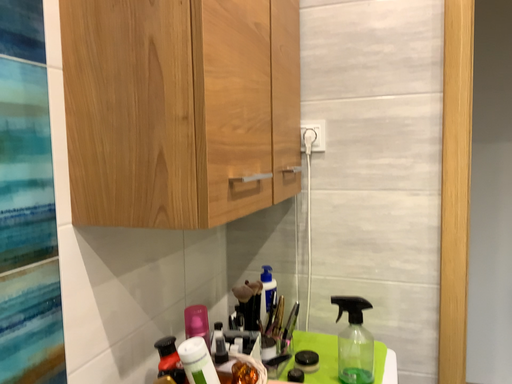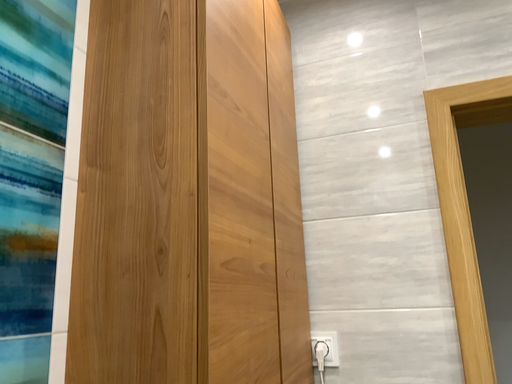
Question: How did the camera likely rotate when shooting the video?

Choices:
 (A) rotated upward
 (B) rotated downward

Answer: (A)